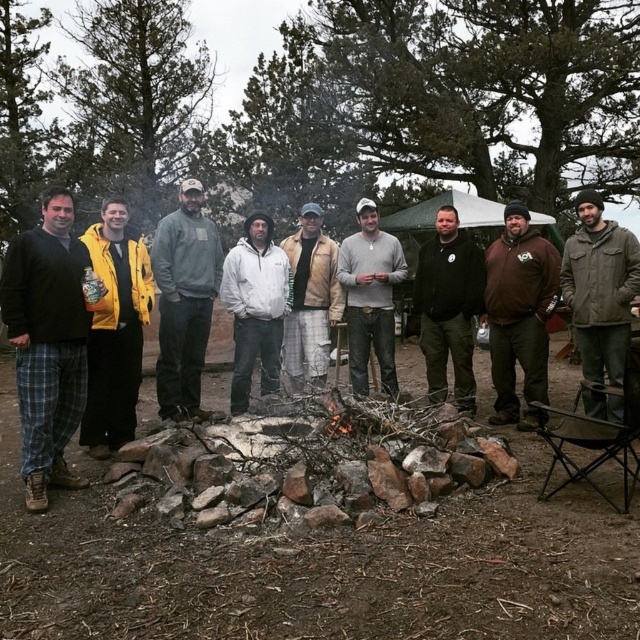
Question: Which object is closer to the camera taking this photo?

Choices:
 (A) light gray sweater at center
 (B) leather jacket at center
 (C) brown matte jacket at center

Answer: (C)

Question: Is plaid flannel pants at left below brown matte jacket at center?

Choices:
 (A) yes
 (B) no

Answer: (A)

Question: Does plaid flannel pants at left appear on the left side of yellow matte jacket at left?

Choices:
 (A) yes
 (B) no

Answer: (A)

Question: Which of the following is the closest to the observer?

Choices:
 (A) (134, 337)
 (B) (248, 218)
 (C) (161, 326)

Answer: (A)

Question: Is dark gray fleece jacket at center positioned in front of brown matte jacket at center?

Choices:
 (A) yes
 (B) no

Answer: (B)

Question: Which point is farther from the camera taking this photo?

Choices:
 (A) 547,266
 (B) 92,456

Answer: (A)